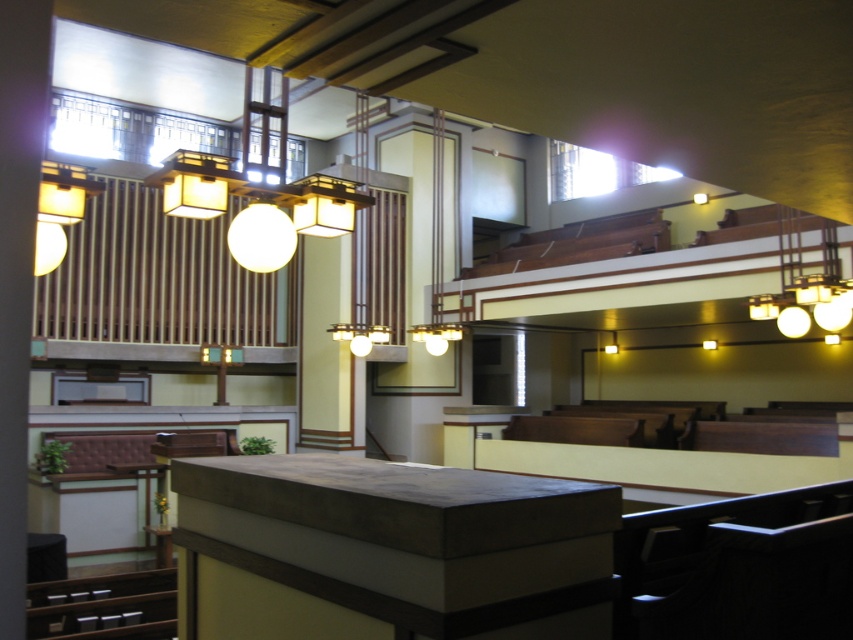
Question: Which point appears farthest from the camera in this image?

Choices:
 (A) (784, 320)
 (B) (163, 195)

Answer: (A)

Question: Can you confirm if matte gold chandelier at upper center is positioned to the right of matte white chandelier at upper right?

Choices:
 (A) yes
 (B) no

Answer: (B)

Question: Among these objects, which one is farthest from the camera?

Choices:
 (A) matte white chandelier at upper right
 (B) matte gold chandelier at upper center

Answer: (A)

Question: Which point is farther to the camera?

Choices:
 (A) (827, 272)
 (B) (260, 259)

Answer: (A)

Question: From the image, what is the correct spatial relationship of matte gold chandelier at upper center in relation to matte white chandelier at upper right?

Choices:
 (A) above
 (B) below

Answer: (A)

Question: Is matte gold chandelier at upper center closer to the viewer compared to matte white chandelier at upper right?

Choices:
 (A) yes
 (B) no

Answer: (A)